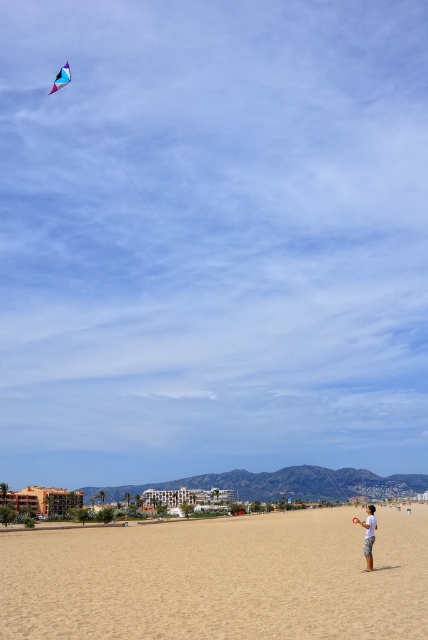
Which of these two, sandy beach at lower center or light blue cotton shorts at lower right, stands taller?

With more height is light blue cotton shorts at lower right.

Does sandy beach at lower center lie behind light blue cotton shorts at lower right?

No, sandy beach at lower center is in front of light blue cotton shorts at lower right.

Is point (137, 554) closer to viewer compared to point (372, 568)?

No, it is behind (372, 568).

Identify the location of sandy beach at lower center. (219, 579).

Is sandy beach at lower center wider than translucent blue kite at upper left?

Yes, sandy beach at lower center is wider than translucent blue kite at upper left.

Does sandy beach at lower center have a larger size compared to translucent blue kite at upper left?

Yes, sandy beach at lower center is bigger than translucent blue kite at upper left.

This screenshot has height=640, width=428. I want to click on sandy beach at lower center, so click(x=219, y=579).

This screenshot has height=640, width=428. I want to click on sandy beach at lower center, so click(219, 579).

Is point (365, 544) positioned in front of point (64, 70)?

Yes, point (365, 544) is closer to viewer.

Can you confirm if light blue cotton shorts at lower right is smaller than translucent blue kite at upper left?

Actually, light blue cotton shorts at lower right might be larger than translucent blue kite at upper left.

Where is `light blue cotton shorts at lower right`? This screenshot has width=428, height=640. light blue cotton shorts at lower right is located at coordinates (368, 536).